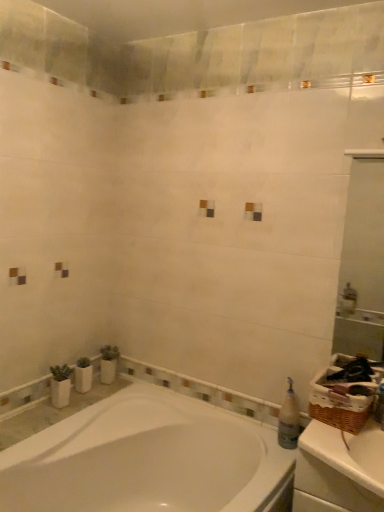
The height and width of the screenshot is (512, 384). In order to click on translucent plastic bottle at right in this screenshot , I will do click(x=289, y=419).

Image resolution: width=384 pixels, height=512 pixels. What do you see at coordinates (362, 262) in the screenshot?
I see `white glossy mirror at upper right` at bounding box center [362, 262].

What do you see at coordinates (341, 468) in the screenshot?
I see `white matte counter top at right` at bounding box center [341, 468].

Identify the location of white matte counter top at right. (341, 468).

Where is `translucent plastic bottle at right`? The width and height of the screenshot is (384, 512). translucent plastic bottle at right is located at coordinates (289, 419).

Is white matte counter top at right completely or partially outside of translucent plastic bottle at right?

Absolutely, white matte counter top at right is external to translucent plastic bottle at right.

Are white matte counter top at right and translucent plastic bottle at right far apart?

white matte counter top at right is near translucent plastic bottle at right, not far away.

Is white matte counter top at right shorter than translucent plastic bottle at right?

Yes, white matte counter top at right is shorter than translucent plastic bottle at right.

In the scene shown: From a real-world perspective, which object rests below the other?

From a 3D spatial view, white matte counter top at right is below.

From a real-world perspective, is translucent plastic bottle at right positioned under white glossy bathtub at lower left based on gravity?

Incorrect, from a real-world perspective, translucent plastic bottle at right is higher than white glossy bathtub at lower left.

What's the angular difference between translucent plastic bottle at right and white glossy bathtub at lower left's facing directions?

87.8 degrees.

In the scene shown: Between translucent plastic bottle at right and white glossy bathtub at lower left, which one has larger size?

With larger size is white glossy bathtub at lower left.

Can you confirm if translucent plastic bottle at right is wider than white glossy bathtub at lower left?

No, translucent plastic bottle at right is not wider than white glossy bathtub at lower left.

Is point (119, 418) closer to camera compared to point (381, 467)?

No, (119, 418) is behind (381, 467).

From the image's perspective, who appears lower, white glossy bathtub at lower left or white matte counter top at right?

white glossy bathtub at lower left appears lower in the image.

Image resolution: width=384 pixels, height=512 pixels. Find the location of `counter top behind the white glossy bathtub at lower left`. counter top behind the white glossy bathtub at lower left is located at coordinates (341, 468).

How many degrees apart are the facing directions of white glossy bathtub at lower left and white matte counter top at right?

white glossy bathtub at lower left and white matte counter top at right are facing 90.1 degrees away from each other.

Which object is positioned more to the right, white glossy bathtub at lower left or translucent plastic bottle at right?

translucent plastic bottle at right is more to the right.

Is translucent plastic bottle at right located within white glossy bathtub at lower left?

No, translucent plastic bottle at right is not inside white glossy bathtub at lower left.

From a real-world perspective, is white glossy bathtub at lower left on translucent plastic bottle at right?

No, from a real-world perspective, white glossy bathtub at lower left is not above translucent plastic bottle at right.

What are the coordinates of `bathtub beneath the white matte counter top at right (from a real-world perspective)` in the screenshot? It's located at (147, 459).

Between white matte counter top at right and white glossy bathtub at lower left, which one has smaller size?

white matte counter top at right is smaller.

Based on the photo, is white matte counter top at right positioned with its back to white glossy bathtub at lower left?

No, white matte counter top at right's orientation is not away from white glossy bathtub at lower left.

Who is shorter, white matte counter top at right or white glossy bathtub at lower left?

Standing shorter between the two is white matte counter top at right.

Would you say white glossy bathtub at lower left is a long distance from white glossy mirror at upper right?

Absolutely, white glossy bathtub at lower left is distant from white glossy mirror at upper right.

From the picture: Is white glossy bathtub at lower left facing away from white glossy mirror at upper right?

No, white glossy bathtub at lower left's orientation is not away from white glossy mirror at upper right.

Is point (186, 502) in front of point (358, 220)?

That is True.

Find the location of a particular element. toiletry beneath the white glossy mirror at upper right (from a real-world perspective) is located at coordinates (289, 419).

Can you confirm if white glossy mirror at upper right is shorter than translucent plastic bottle at right?

No, white glossy mirror at upper right is not shorter than translucent plastic bottle at right.

Does white glossy mirror at upper right have a lesser width compared to translucent plastic bottle at right?

Indeed, white glossy mirror at upper right has a lesser width compared to translucent plastic bottle at right.

Can you see white glossy mirror at upper right touching translucent plastic bottle at right?

white glossy mirror at upper right and translucent plastic bottle at right are clearly separated.

In order to click on counter top below the translucent plastic bottle at right (from the image's perspective) in this screenshot , I will do `click(341, 468)`.

At what (x,y) coordinates should I click in order to perform the action: click on bathtub on the left of translucent plastic bottle at right. Please return your answer as a coordinate pair (x, y). This screenshot has height=512, width=384. Looking at the image, I should click on 147,459.

Looking at the image, which one is located further to white glossy bathtub at lower left, white matte counter top at right or white glossy mirror at upper right?

white glossy mirror at upper right.

From the image, which object appears to be farther from white glossy bathtub at lower left, translucent plastic bottle at right or white glossy mirror at upper right?

Among the two, white glossy mirror at upper right is located further to white glossy bathtub at lower left.

Which object lies nearer to the anchor point white matte counter top at right, white glossy mirror at upper right or translucent plastic bottle at right?

Based on the image, translucent plastic bottle at right appears to be nearer to white matte counter top at right.

Based on their spatial positions, is white glossy mirror at upper right or white glossy bathtub at lower left further from translucent plastic bottle at right?

white glossy mirror at upper right is positioned further to the anchor translucent plastic bottle at right.

Based on their spatial positions, is white glossy bathtub at lower left or white glossy mirror at upper right further from translucent plastic bottle at right?

white glossy mirror at upper right.

When comparing their distances from translucent plastic bottle at right, does white matte counter top at right or white glossy bathtub at lower left seem further?

white glossy bathtub at lower left is positioned further to the anchor translucent plastic bottle at right.

Consider the image. Based on their spatial positions, is white matte counter top at right or white glossy mirror at upper right further from translucent plastic bottle at right?

white glossy mirror at upper right is further to translucent plastic bottle at right.

When comparing their distances from white glossy mirror at upper right, does white glossy bathtub at lower left or white matte counter top at right seem further?

Among the two, white matte counter top at right is located further to white glossy mirror at upper right.

At what (x,y) coordinates should I click in order to perform the action: click on toiletry between white glossy mirror at upper right and white glossy bathtub at lower left vertically. Please return your answer as a coordinate pair (x, y). The height and width of the screenshot is (512, 384). Looking at the image, I should click on coord(289,419).

Locate an element on the screen. This screenshot has width=384, height=512. counter top that lies between white glossy mirror at upper right and white glossy bathtub at lower left from top to bottom is located at coordinates (341, 468).

Where is `toiletry between white glossy bathtub at lower left and white matte counter top at right in the horizontal direction`? This screenshot has height=512, width=384. toiletry between white glossy bathtub at lower left and white matte counter top at right in the horizontal direction is located at coordinates (289, 419).

Where is `toiletry between white glossy mirror at upper right and white matte counter top at right in the up-down direction`? toiletry between white glossy mirror at upper right and white matte counter top at right in the up-down direction is located at coordinates (289, 419).